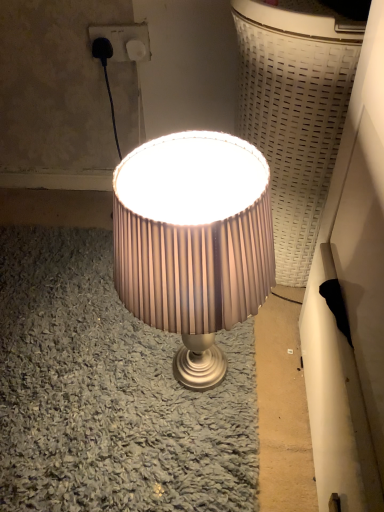
Question: Does matte beige lampshade at center have a greater height compared to white plastic socket at upper center?

Choices:
 (A) yes
 (B) no

Answer: (A)

Question: Can you confirm if matte beige lampshade at center is shorter than white plastic socket at upper center?

Choices:
 (A) yes
 (B) no

Answer: (B)

Question: Does matte beige lampshade at center appear on the left side of white plastic socket at upper center?

Choices:
 (A) no
 (B) yes

Answer: (A)

Question: From the image's perspective, does matte beige lampshade at center appear lower than white plastic socket at upper center?

Choices:
 (A) no
 (B) yes

Answer: (B)

Question: From a real-world perspective, is matte beige lampshade at center beneath white plastic socket at upper center?

Choices:
 (A) no
 (B) yes

Answer: (B)

Question: Is matte beige lampshade at center aimed at white plastic socket at upper center?

Choices:
 (A) no
 (B) yes

Answer: (A)

Question: Are white plastic socket at upper center and matte beige lampshade at center beside each other?

Choices:
 (A) no
 (B) yes

Answer: (A)

Question: Is white plastic socket at upper center taller than matte beige lampshade at center?

Choices:
 (A) yes
 (B) no

Answer: (B)

Question: Would you consider white plastic socket at upper center to be distant from matte beige lampshade at center?

Choices:
 (A) yes
 (B) no

Answer: (B)

Question: Can you confirm if white plastic socket at upper center is smaller than matte beige lampshade at center?

Choices:
 (A) no
 (B) yes

Answer: (B)

Question: Is white plastic socket at upper center facing towards matte beige lampshade at center?

Choices:
 (A) no
 (B) yes

Answer: (B)

Question: Is white plastic socket at upper center further to the viewer compared to matte beige lampshade at center?

Choices:
 (A) no
 (B) yes

Answer: (B)

Question: Is matte beige lampshade at center wider or thinner than white plastic socket at upper center?

Choices:
 (A) thin
 (B) wide

Answer: (B)